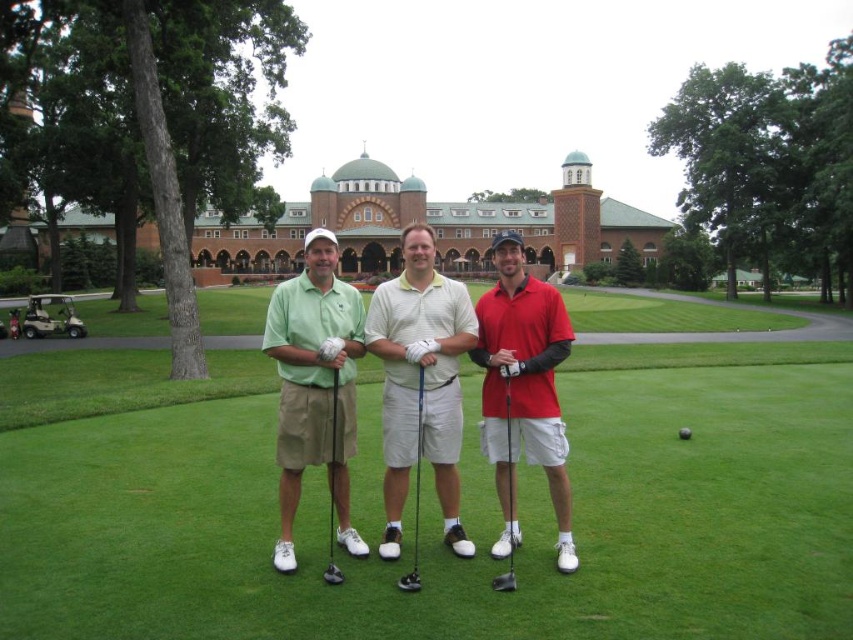
Question: Among these objects, which one is nearest to the camera?

Choices:
 (A) green matte golf club at center
 (B) black rubber golf club at center
 (C) metallic silver golf club at center

Answer: (C)

Question: Is matte black golf club at center above metallic silver golf club at center?

Choices:
 (A) no
 (B) yes

Answer: (A)

Question: Which point is closer to the camera taking this photo?

Choices:
 (A) (218, 531)
 (B) (399, 588)

Answer: (B)

Question: Does green grass at center have a greater width compared to metallic silver golf club at center?

Choices:
 (A) yes
 (B) no

Answer: (A)

Question: Is green grass at center bigger than matte black golf club at center?

Choices:
 (A) yes
 (B) no

Answer: (A)

Question: Which object is the farthest from the white cotton polo shirt at center?

Choices:
 (A) matte red polo shirt at center
 (B) matte black golf club at center
 (C) black rubber golf ball at center
 (D) green grass at center

Answer: (C)